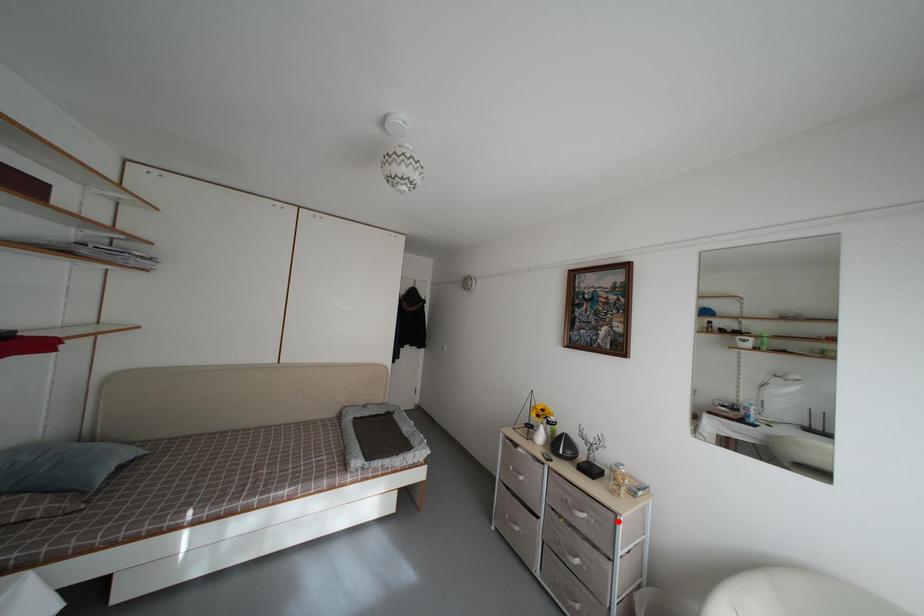
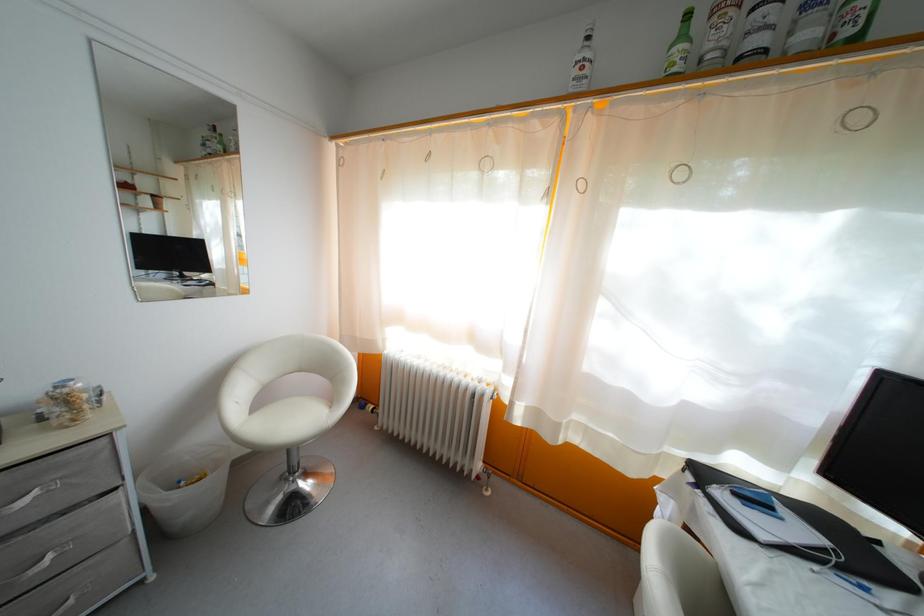
In the second image, find the point that corresponds to the highlighted location in the first image.

(110, 447)